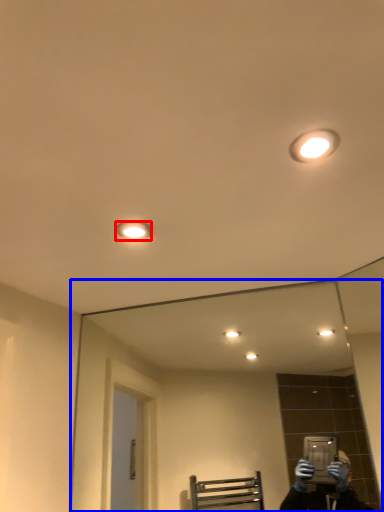
Question: Which object appears closest to the camera in this image, light fixture (highlighted by a red box) or mirror (highlighted by a blue box)?

Choices:
 (A) light fixture
 (B) mirror

Answer: (A)